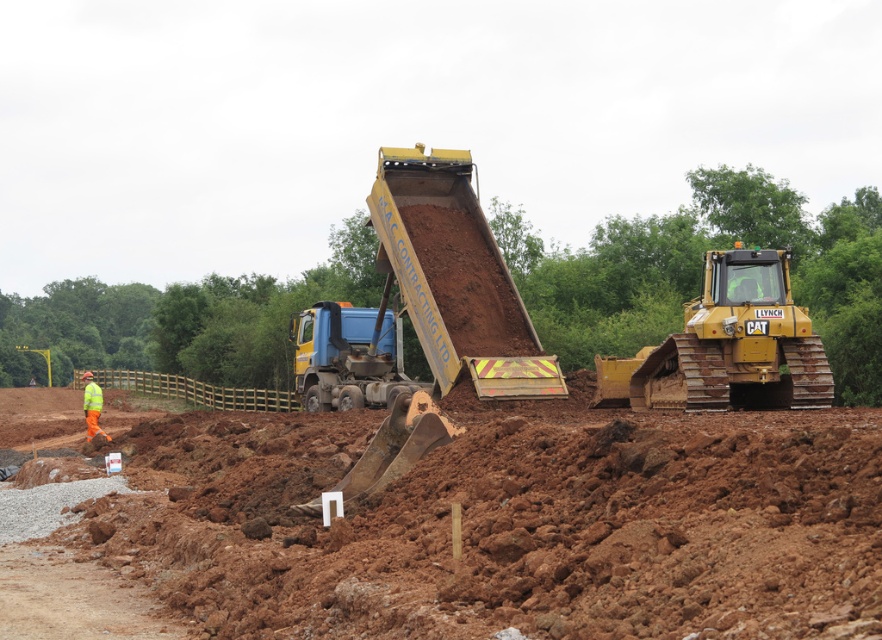
From the picture: You are a construction inspector standing at point (507, 525). What material are you standing on?

You are standing on brown earth at center.